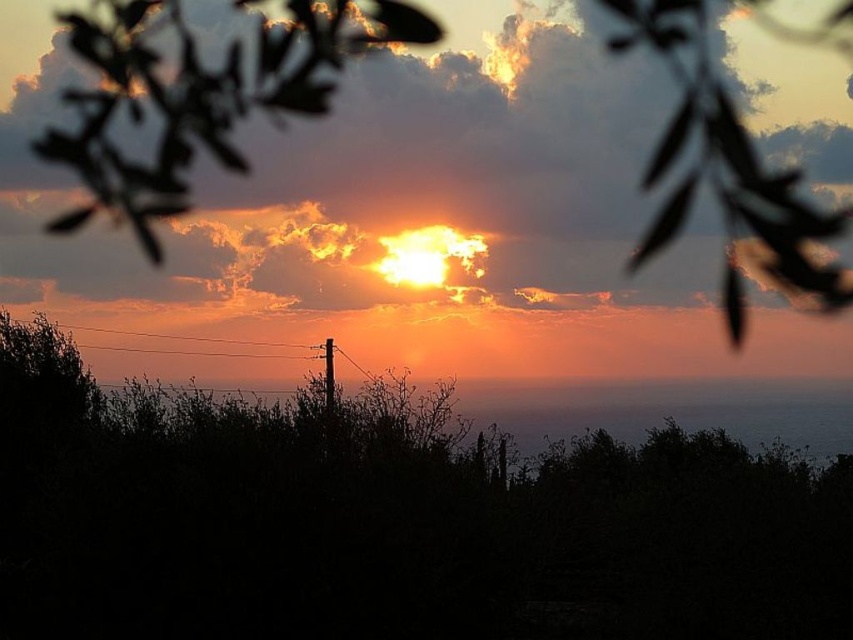
You are standing at the center of the image and want to walk towards the green leafy tree at center. Which direction should you face to walk directly towards it?

The green leafy tree at center is already at the center of the image, so you are already facing it. You can walk straight ahead towards the green leafy tree at center.

Consider the image. You are an artist sketching this sunset scene. You want to ensure the silvery metallic leaves at upper left and the smooth wooden telegraph pole at center are proportionally accurate. Which object should you draw taller in your sketch?

The silvery metallic leaves at upper left should be drawn taller than the smooth wooden telegraph pole at center because the silvery metallic leaves at upper left has a greater height compared to smooth wooden telegraph pole at center according to the description.

You are an artist trying to paint this sunset scene. You want to ensure the silvery metallic leaves at upper left and the smooth wooden telegraph pole at center are positioned correctly according to their spatial relationship. Which object should appear closer to you in your painting?

The silvery metallic leaves at upper left should appear closer to you in your painting because they are positioned in front of the smooth wooden telegraph pole at center.